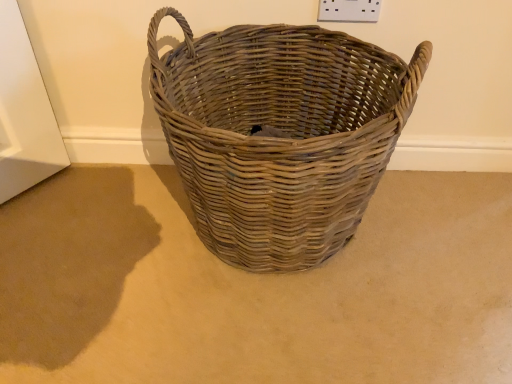
This screenshot has height=384, width=512. Identify the location of blank space to the left of natural woven basket at center. (89, 244).